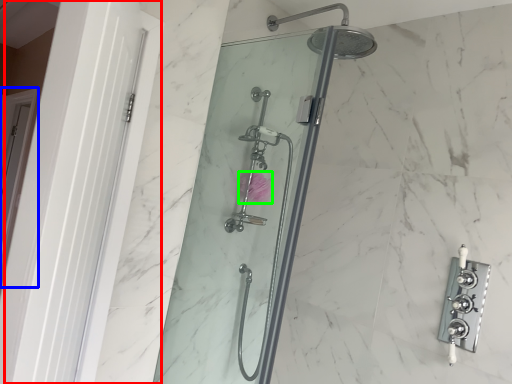
Question: Considering the real-world distances, which object is farthest from screen door (highlighted by a red box)? screen door (highlighted by a blue box) or flower (highlighted by a green box)?

Choices:
 (A) screen door
 (B) flower

Answer: (A)